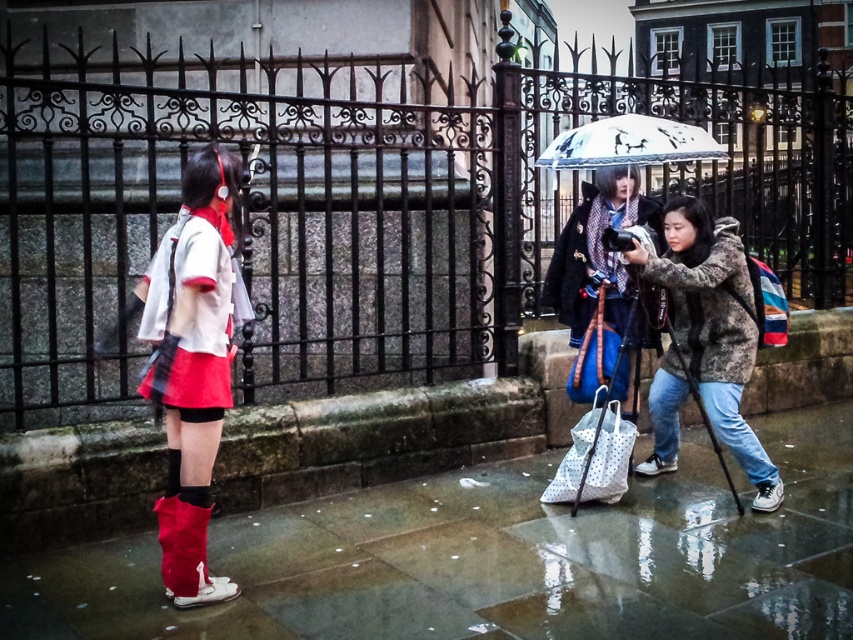
Can you confirm if camouflage fabric jacket at center is smaller than white glossy umbrella at upper center?

Incorrect, camouflage fabric jacket at center is not smaller in size than white glossy umbrella at upper center.

Is point (593, 218) positioned behind point (584, 156)?

Yes, point (593, 218) is farther from viewer.

This screenshot has height=640, width=853. Describe the element at coordinates (601, 275) in the screenshot. I see `camouflage fabric jacket at center` at that location.

Locate an element on the screen. This screenshot has height=640, width=853. camouflage fabric jacket at center is located at coordinates coord(601,275).

Who is more forward, [170,296] or [668,157]?

Positioned in front is point [170,296].

Can you confirm if matte red skirt at left is smaller than white glossy umbrella at upper center?

Correct, matte red skirt at left occupies less space than white glossy umbrella at upper center.

Who is more forward, [225,337] or [596,157]?

Point [225,337] is more forward.

At what (x,y) coordinates should I click in order to perform the action: click on matte red skirt at left. Please return your answer as a coordinate pair (x, y). The width and height of the screenshot is (853, 640). Looking at the image, I should click on (190, 365).

Does shiny concrete pavement at lower center appear on the right side of camouflage jacket at lower right?

Incorrect, shiny concrete pavement at lower center is not on the right side of camouflage jacket at lower right.

Which is in front, point (62, 548) or point (706, 323)?

Point (62, 548) is in front.

Locate an element on the screen. Image resolution: width=853 pixels, height=640 pixels. shiny concrete pavement at lower center is located at coordinates (494, 557).